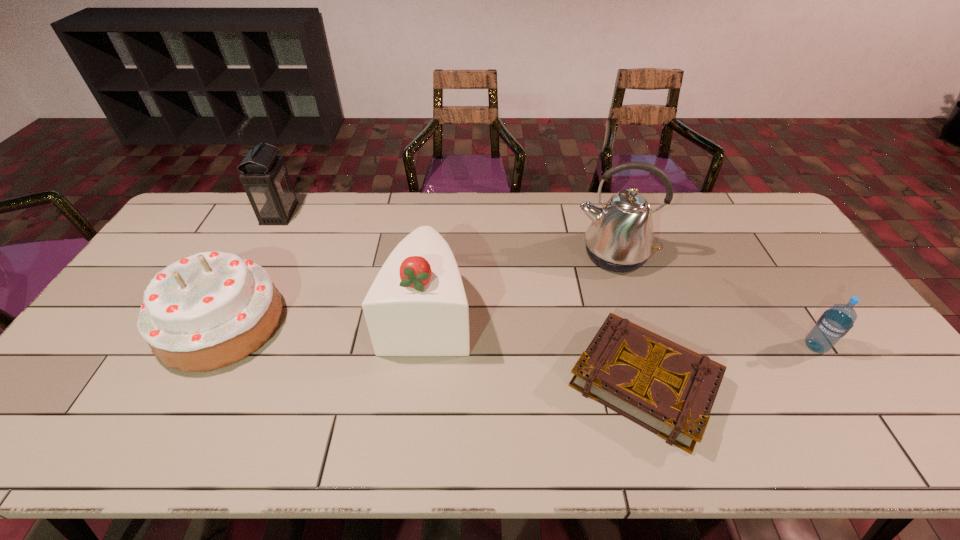
Locate an element on the screen. Image resolution: width=960 pixels, height=540 pixels. free space between the fourth tallest object and the water bottle is located at coordinates (518, 335).

Identify the location of free spot between the kettle and the second shortest object. This screenshot has width=960, height=540. click(x=714, y=300).

Identify the location of empty space between the lantern and the taller cake. (353, 264).

This screenshot has width=960, height=540. What are the coordinates of `empty location between the water bottle and the kettle` in the screenshot? It's located at (714, 300).

Locate an element on the screen. The image size is (960, 540). blank region between the fourth tallest object and the right cake is located at coordinates (324, 319).

This screenshot has height=540, width=960. Find the location of `object identified as the closest to the kettle`. object identified as the closest to the kettle is located at coordinates (668, 389).

Identify which object is the fifth nearest to the farthest object. Please provide its 2D coordinates. Your answer should be formatted as a tuple, i.e. [(x, y)], where the tuple contains the x and y coordinates of a point satisfying the conditions above.

[(834, 323)]

Where is `vacant position in the image that satisfies the following two spatial constraints: 1. on the back side of the hardback book; 2. on the left side of the kettle`? Image resolution: width=960 pixels, height=540 pixels. vacant position in the image that satisfies the following two spatial constraints: 1. on the back side of the hardback book; 2. on the left side of the kettle is located at coordinates (606, 254).

The width and height of the screenshot is (960, 540). Find the location of `vacant space that satisfies the following two spatial constraints: 1. on the front-facing side of the lantern; 2. on the back side of the kettle`. vacant space that satisfies the following two spatial constraints: 1. on the front-facing side of the lantern; 2. on the back side of the kettle is located at coordinates (258, 254).

Where is `vacant space that satisfies the following two spatial constraints: 1. on the back side of the shortest object; 2. on the front-facing side of the farthest object`? vacant space that satisfies the following two spatial constraints: 1. on the back side of the shortest object; 2. on the front-facing side of the farthest object is located at coordinates (593, 214).